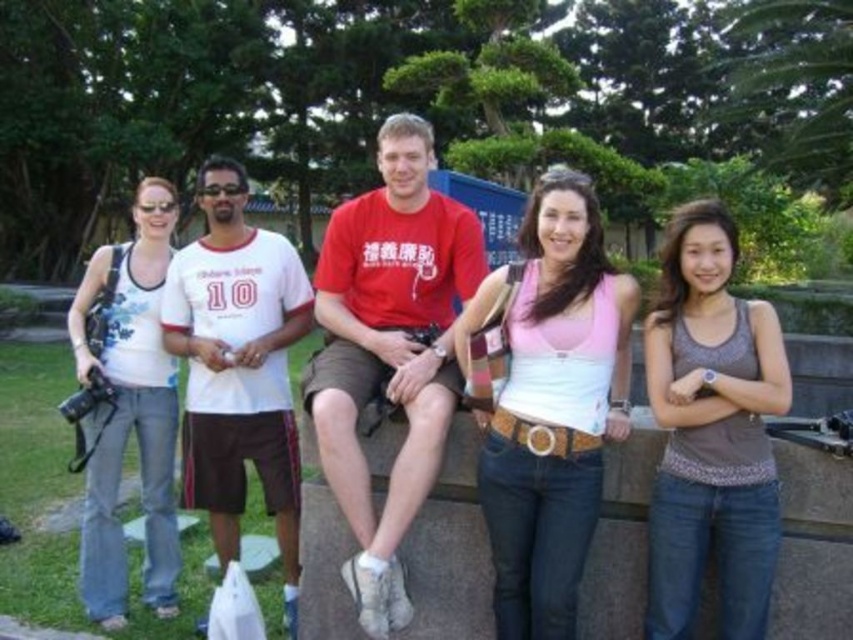
Between red cotton t-shirt at center and gray textured tank top at center, which one is positioned higher?

Positioned higher is red cotton t-shirt at center.

Between point (339, 289) and point (729, 513), which one is positioned in front?

Positioned in front is point (729, 513).

I want to click on red cotton t-shirt at center, so click(389, 349).

Can you confirm if pink fabric tank top at center is wider than white cotton t-shirt at left?

No, pink fabric tank top at center is not wider than white cotton t-shirt at left.

Find the location of a particular element. pink fabric tank top at center is located at coordinates (554, 408).

Which of these two, gray textured tank top at center or white cotton t-shirt at left, stands shorter?

With less height is gray textured tank top at center.

Between gray textured tank top at center and white cotton t-shirt at left, which one appears on the right side from the viewer's perspective?

From the viewer's perspective, gray textured tank top at center appears more on the right side.

Which is in front, point (659, 468) or point (244, 173)?

Positioned in front is point (659, 468).

What are the coordinates of `gray textured tank top at center` in the screenshot? It's located at (711, 432).